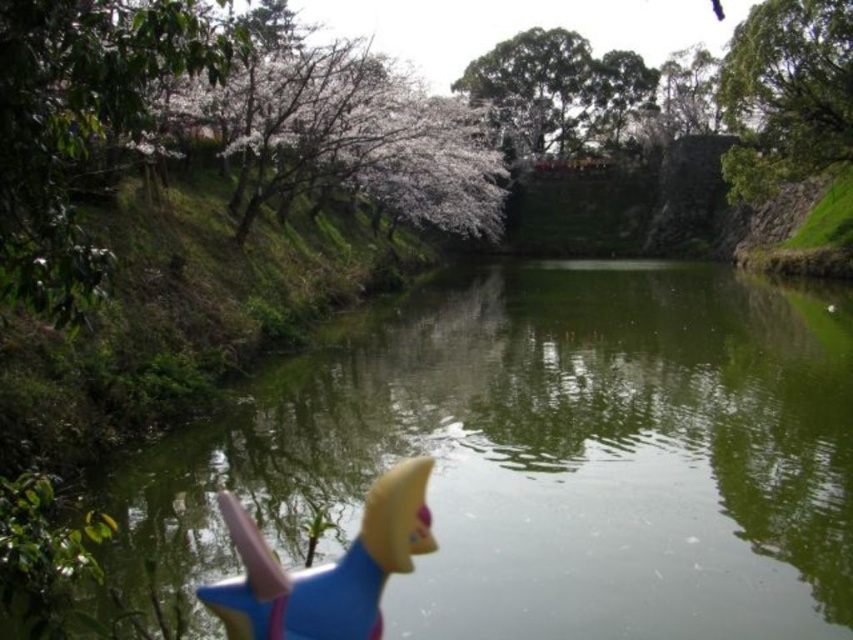
Who is shorter, green smooth water at center or white blossoms at upper left?

green smooth water at center is shorter.

Can you confirm if green smooth water at center is positioned below white blossoms at upper left?

Correct, green smooth water at center is located below white blossoms at upper left.

Describe the element at coordinates (546, 456) in the screenshot. I see `green smooth water at center` at that location.

Locate an element on the screen. green smooth water at center is located at coordinates (546, 456).

Identify the location of white blossoms at upper left. The image size is (853, 640). (347, 131).

Is white blossoms at upper left positioned before green leafy tree at upper right?

Yes.

Who is more forward, (421, 90) or (822, 125)?

Positioned in front is point (822, 125).

The height and width of the screenshot is (640, 853). I want to click on white blossoms at upper left, so click(347, 131).

Does green leafy tree at upper right appear on the right side of blue rubber toy at lower center?

Correct, you'll find green leafy tree at upper right to the right of blue rubber toy at lower center.

Which is in front, point (839, 145) or point (315, 573)?

Point (315, 573) is more forward.

Describe the element at coordinates (786, 93) in the screenshot. I see `green leafy tree at upper right` at that location.

At what (x,y) coordinates should I click in order to perform the action: click on green leafy tree at upper right. Please return your answer as a coordinate pair (x, y). This screenshot has height=640, width=853. Looking at the image, I should click on (786, 93).